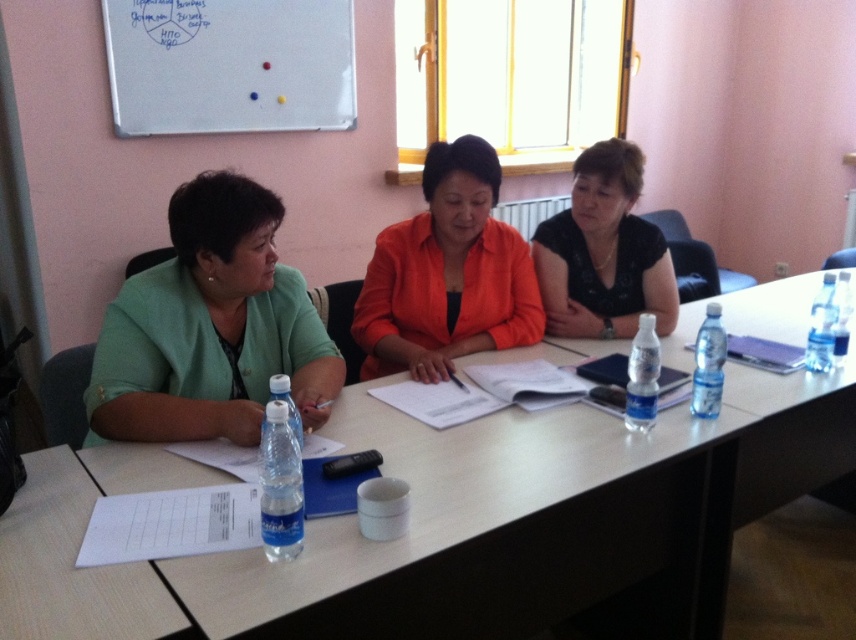
Question: Estimate the real-world distances between objects in this image. Which object is closer to the white glossy table at center?

Choices:
 (A) whiteboard at upper left
 (B) orange matte jacket at center
 (C) green fabric jacket at left

Answer: (C)

Question: Which point is closer to the camera taking this photo?

Choices:
 (A) (604, 195)
 (B) (179, 81)
 (C) (722, 552)
 (D) (467, 156)

Answer: (C)

Question: Does green fabric jacket at left have a greater width compared to whiteboard at upper left?

Choices:
 (A) no
 (B) yes

Answer: (A)

Question: Considering the relative positions of white glossy table at center and whiteboard at upper left in the image provided, where is white glossy table at center located with respect to whiteboard at upper left?

Choices:
 (A) right
 (B) left

Answer: (A)

Question: Which point is closer to the camera?

Choices:
 (A) (317, 316)
 (B) (428, 161)
 (C) (349, 621)
 (D) (146, 120)

Answer: (C)

Question: Is whiteboard at upper left to the left of orange matte jacket at center from the viewer's perspective?

Choices:
 (A) no
 (B) yes

Answer: (B)